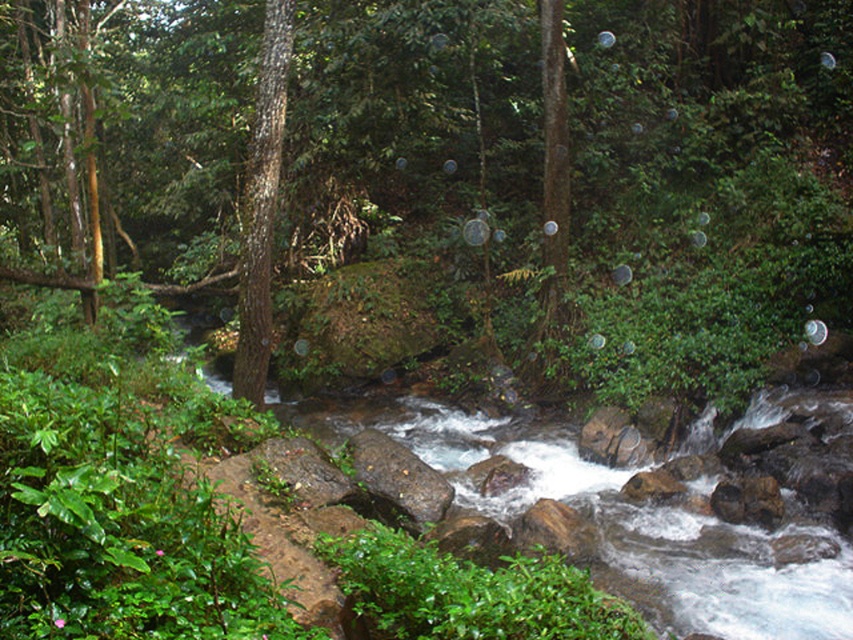
You are a bird looking for a nesting spot. You see a green matte tree at center and a brown rough bark tree at center. Which tree would you choose if you want to build your nest higher up?

The green matte tree at center is taller than the brown rough bark tree at center, so you should choose the green matte tree at center to build your nest higher up.

You are a hiker who wants to take a photo of the green matte tree at center from a specific spot. If you are standing at point 0.5, 0.5, which direction should you move to face the tree?

The green matte tree at center is located at point [595,163]. Since you are at [426,320], you should move northwest to face the tree.

Consider the image. You are standing at the point marked by the coordinate point (595, 163) in the forest scene. Looking around, you notice a green matte tree at center. Can you describe the immediate surroundings of the green matte tree at center?

The green matte tree at center is located at the coordinates point (595, 163), surrounded by a serene forest with a fast moving stream, lush greenery, and large dark brown rocks in the stream.